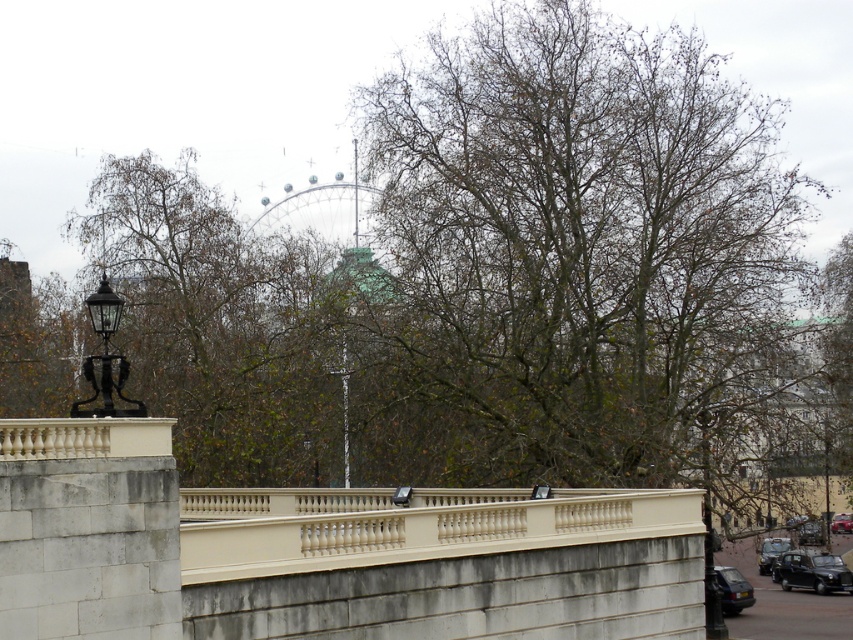
You are a photographer planning to capture a wide shot of the bridge and its surroundings. You notice the bare branches at center and the black matte car at lower right. Which object occupies more horizontal space in the frame?

The bare branches at center occupy more horizontal space in the frame since their width surpasses that of the black matte car at lower right.

You are a delivery person needing to park your vehicle near the bridge. You see two cars parked at the lower right corner of the bridge area. Which car, the black matte car at lower right or the dark gray metallic car at lower right, is positioned closer to the ground?

The black matte car at lower right is located below the dark gray metallic car at lower right, so it is closer to the ground.